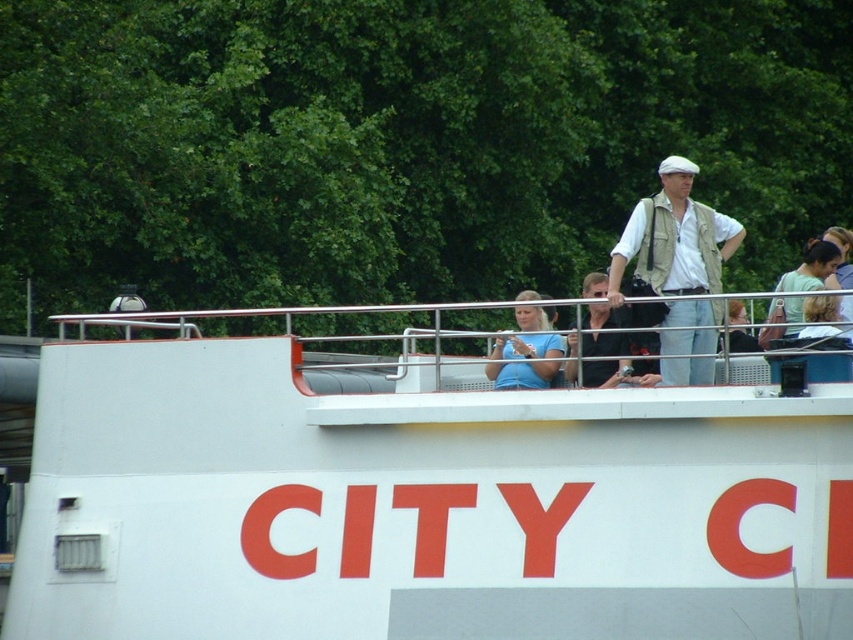
You are standing on the deck of the boat named CITY C. There is a point at coordinates point (540, 316). If you want to throw a small object to that point, can you reach it with an arm length of 2 meters? Explain your reasoning.

The distance between you and the point (540, 316) is 55.55 feet. Since 55.55 feet is approximately 16.93 meters, which is much longer than your arm length of 2 meters, you cannot reach the point with your arm.

You are planning to place a 1.2 meter wide decoration on the white matte boat at center. The decoration must fit entirely within the boat. Given that the light beige vest at center is currently on the boat, can you determine if the decoration will fit on the boat?

The white matte boat at center is wider than the light beige vest at center. However, the exact width of the boat isn not specified. Since the decoration is 1.2 meters wide, but we only know the boat is wider than the vest, we cannot confirm if it will fit without knowing the boat s actual width.

You are a photographer on the boat named CITY C. You need to take a photo of the matte blue shirt at center and the light brown leather jacket at upper right. Which object is shorter?

The matte blue shirt at center is shorter than the light brown leather jacket at upper right.